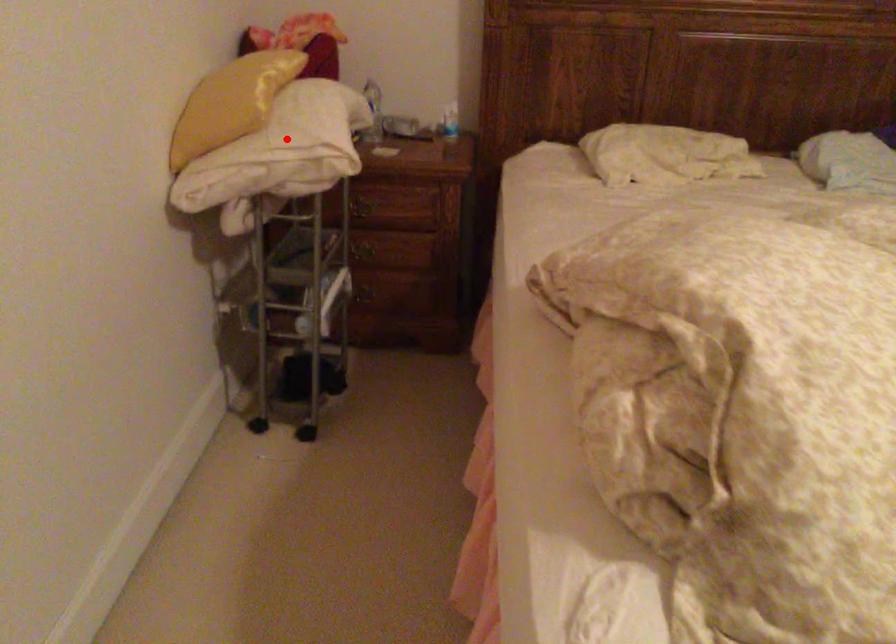
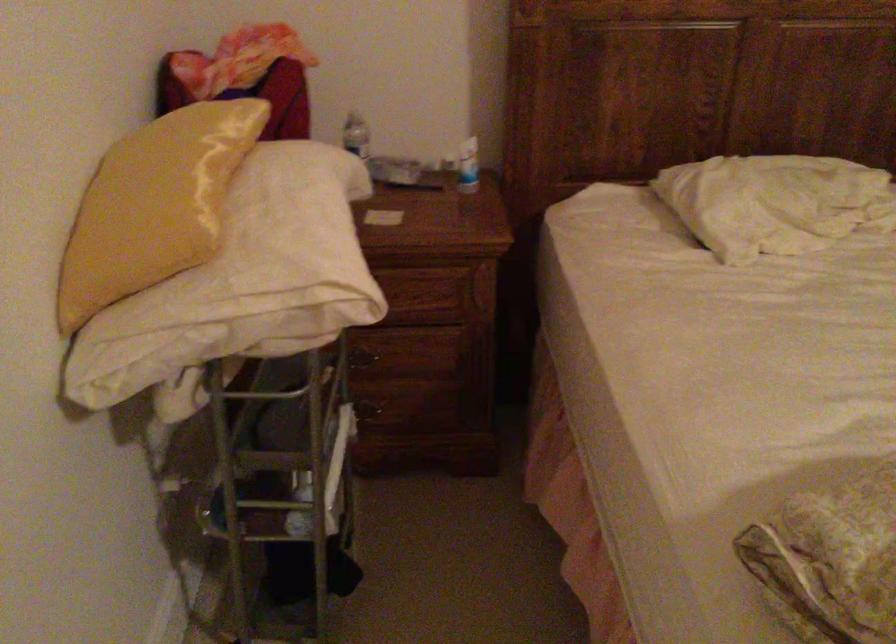
Question: I am providing you with two images of the same scene from different viewpoints. Given a red point in image1, look at the same physical point in image2. Is it:

Choices:
 (A) Closer to the viewpoint
 (B) Farther from the viewpoint

Answer: (A)